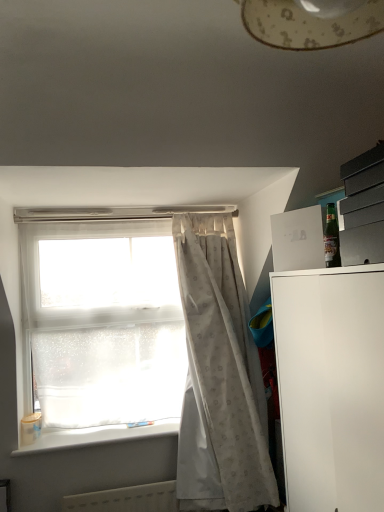
Question: Is white plastic radiator at lower center turned away from transparent plastic window at upper left?

Choices:
 (A) yes
 (B) no

Answer: (B)

Question: Is white plastic radiator at lower center to the right of transparent plastic window at upper left from the viewer's perspective?

Choices:
 (A) yes
 (B) no

Answer: (A)

Question: Would you say white plastic radiator at lower center is a long distance from transparent plastic window at upper left?

Choices:
 (A) yes
 (B) no

Answer: (B)

Question: From a real-world perspective, is white plastic radiator at lower center physically below transparent plastic window at upper left?

Choices:
 (A) yes
 (B) no

Answer: (A)

Question: Can we say white plastic radiator at lower center lies outside transparent plastic window at upper left?

Choices:
 (A) no
 (B) yes

Answer: (B)

Question: Is point (160, 425) positioned closer to the camera than point (79, 330)?

Choices:
 (A) closer
 (B) farther

Answer: (A)

Question: Considering the positions of white plastic window sill at lower left and transparent plastic window at upper left in the image, is white plastic window sill at lower left taller or shorter than transparent plastic window at upper left?

Choices:
 (A) tall
 (B) short

Answer: (B)

Question: In the image, is white plastic window sill at lower left on the left side or the right side of transparent plastic window at upper left?

Choices:
 (A) right
 (B) left

Answer: (B)

Question: From a real-world perspective, relative to transparent plastic window at upper left, is white plastic window sill at lower left vertically above or below?

Choices:
 (A) below
 (B) above

Answer: (A)

Question: Considering the positions of green glass bottle at upper right and white plastic radiator at lower center in the image, is green glass bottle at upper right wider or thinner than white plastic radiator at lower center?

Choices:
 (A) thin
 (B) wide

Answer: (A)

Question: Considering the positions of green glass bottle at upper right and white plastic radiator at lower center in the image, is green glass bottle at upper right bigger or smaller than white plastic radiator at lower center?

Choices:
 (A) small
 (B) big

Answer: (A)

Question: Would you say green glass bottle at upper right is inside or outside white plastic radiator at lower center?

Choices:
 (A) inside
 (B) outside

Answer: (B)

Question: From the image's perspective, relative to white plastic radiator at lower center, is green glass bottle at upper right above or below?

Choices:
 (A) above
 (B) below

Answer: (A)

Question: In terms of size, does transparent plastic window at upper left appear bigger or smaller than white matte/file cabinet at right?

Choices:
 (A) big
 (B) small

Answer: (B)

Question: Looking at their shapes, would you say transparent plastic window at upper left is wider or thinner than white matte/file cabinet at right?

Choices:
 (A) wide
 (B) thin

Answer: (B)